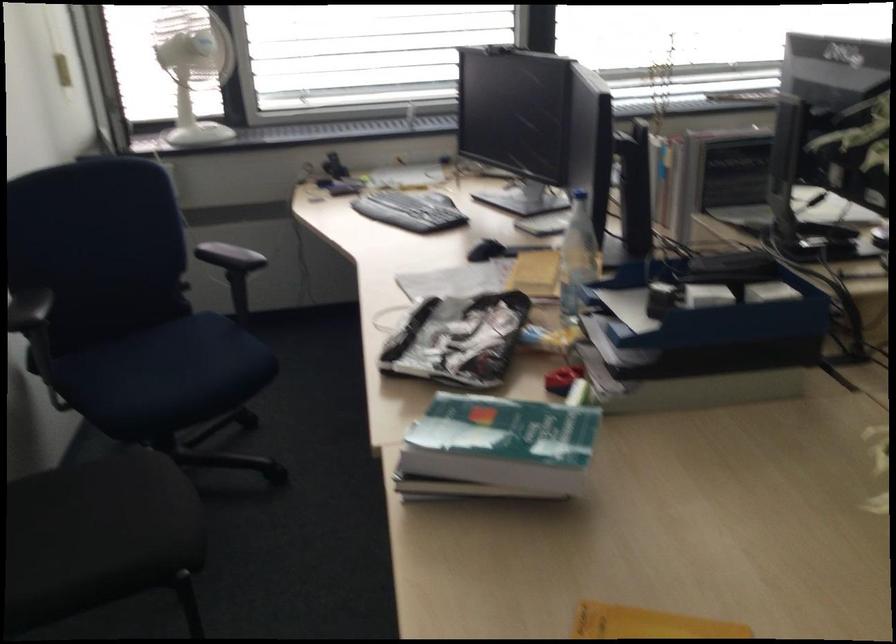
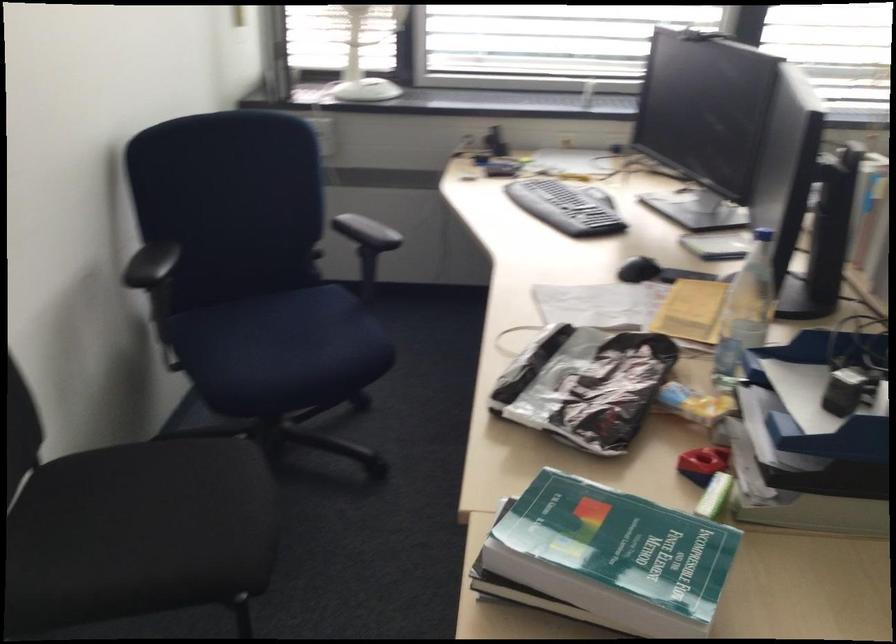
Locate, in the second image, the point that corresponds to (x=165, y=375) in the first image.

(278, 346)